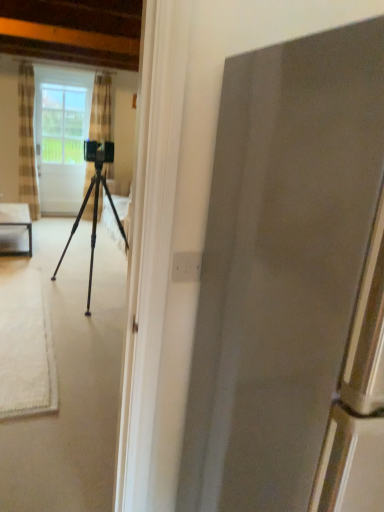
Image resolution: width=384 pixels, height=512 pixels. Identify the location of free point above checkered fabric curtain at left, the 1th curtain positioned from the left (from a real-world perspective). (20, 64).